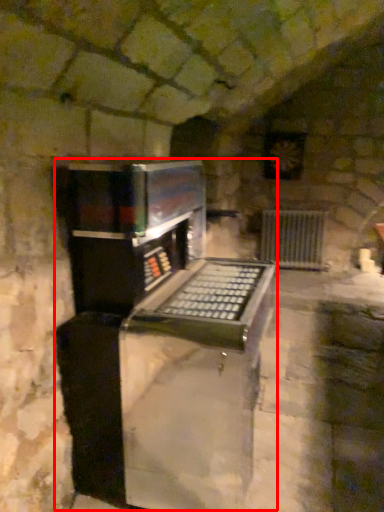
Question: Where is appliance (annotated by the red box) located in relation to radiator in the image?

Choices:
 (A) right
 (B) left

Answer: (B)